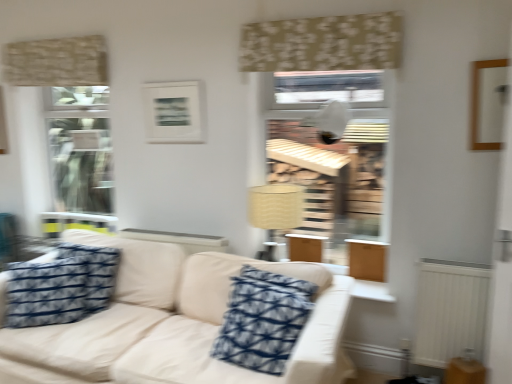
Where is `beige floral fabric at upper center, which is the 2th curtain in left-to-right order`? This screenshot has width=512, height=384. beige floral fabric at upper center, which is the 2th curtain in left-to-right order is located at coordinates (322, 43).

Where is `beige fabric lampshade at center`? beige fabric lampshade at center is located at coordinates (275, 211).

Describe the element at coordinates (61, 286) in the screenshot. This screenshot has width=512, height=384. I see `blue printed fabric pillow at left, acting as the second pillow starting from the right` at that location.

What is the approximate width of blue printed fabric pillow at left, which is counted as the 1th pillow, starting from the left?

11.72 inches.

What is the approximate width of beige textured curtain at upper left, positioned as the 2th curtain in front-to-back order?

beige textured curtain at upper left, positioned as the 2th curtain in front-to-back order, is 4.72 inches in width.

Describe the element at coordinates (488, 103) in the screenshot. I see `wooden picture frame at upper right, which is counted as the second picture frame, starting from the back` at that location.

Locate an element on the screen. This screenshot has width=512, height=384. beige floral fabric at upper center, which appears as the 1th curtain when viewed from the front is located at coordinates (322, 43).

Do you think blue printed fabric pillow at center, placed as the 1th pillow when sorted from right to left, is within wooden picture frame at upper right, placed as the first picture frame when sorted from front to back, or outside of it?

blue printed fabric pillow at center, placed as the 1th pillow when sorted from right to left, lies outside wooden picture frame at upper right, placed as the first picture frame when sorted from front to back.

Considering the relative sizes of blue printed fabric pillow at center, placed as the 1th pillow when sorted from right to left, and wooden picture frame at upper right, which is counted as the second picture frame, starting from the back, in the image provided, is blue printed fabric pillow at center, placed as the 1th pillow when sorted from right to left, taller than wooden picture frame at upper right, which is counted as the second picture frame, starting from the back,?

Correct, blue printed fabric pillow at center, placed as the 1th pillow when sorted from right to left, is much taller as wooden picture frame at upper right, which is counted as the second picture frame, starting from the back.

From a real-world perspective, between blue printed fabric pillow at center, placed as the 1th pillow when sorted from right to left, and wooden picture frame at upper right, placed as the first picture frame when sorted from front to back, who is vertically lower?

blue printed fabric pillow at center, placed as the 1th pillow when sorted from right to left.

Is point (257, 289) positioned before point (497, 117)?

Yes, point (257, 289) is closer to viewer.

At what (x,y) coordinates should I click in order to perform the action: click on table on the left of wooden picture frame at upper right, the first picture frame when ordered from right to left. Please return your answer as a coordinate pair (x, y). The height and width of the screenshot is (384, 512). Looking at the image, I should click on (464, 371).

In the scene shown: Measure the distance between wooden table at lower right and wooden picture frame at upper right, the first picture frame when ordered from right to left.

They are 4.16 feet apart.

From the image's perspective, which one is positioned lower, wooden table at lower right or wooden picture frame at upper right, positioned as the second picture frame in left-to-right order?

From the image's view, wooden table at lower right is below.

What's the angular difference between wooden table at lower right and wooden picture frame at upper right, positioned as the second picture frame in left-to-right order,'s facing directions?

The facing directions of wooden table at lower right and wooden picture frame at upper right, positioned as the second picture frame in left-to-right order, are 52.9 degrees apart.

Where is `the 2nd curtain to the left when counting from the white textured radiator at lower right`? the 2nd curtain to the left when counting from the white textured radiator at lower right is located at coordinates (56, 62).

Is beige textured curtain at upper left, acting as the first curtain starting from the left, looking in the opposite direction of white textured radiator at lower right?

No, beige textured curtain at upper left, acting as the first curtain starting from the left, is not facing away from white textured radiator at lower right.

Would you say beige textured curtain at upper left, arranged as the second curtain when viewed from the right, is to the left or to the right of white textured radiator at lower right in the picture?

beige textured curtain at upper left, arranged as the second curtain when viewed from the right, is to the left of white textured radiator at lower right.

Looking at this image, would you consider beige textured curtain at upper left, positioned as the 2th curtain in front-to-back order, to be distant from white textured radiator at lower right?

That's right, there is a large distance between beige textured curtain at upper left, positioned as the 2th curtain in front-to-back order, and white textured radiator at lower right.

Considering the positions of objects wooden picture frame at upper right, placed as the first picture frame when sorted from front to back, and blue printed fabric pillow at left, which is counted as the 1th pillow, starting from the left, in the image provided, who is behind, wooden picture frame at upper right, placed as the first picture frame when sorted from front to back, or blue printed fabric pillow at left, which is counted as the 1th pillow, starting from the left,?

blue printed fabric pillow at left, which is counted as the 1th pillow, starting from the left, is further from the camera.

From a real-world perspective, is wooden picture frame at upper right, the first picture frame when ordered from right to left, positioned above or below blue printed fabric pillow at left, acting as the second pillow starting from the right?

From a real-world perspective, wooden picture frame at upper right, the first picture frame when ordered from right to left, is physically above blue printed fabric pillow at left, acting as the second pillow starting from the right.

How different are the orientations of wooden picture frame at upper right, placed as the first picture frame when sorted from front to back, and blue printed fabric pillow at left, which is counted as the 1th pillow, starting from the left, in degrees?

Answer: The facing directions of wooden picture frame at upper right, placed as the first picture frame when sorted from front to back, and blue printed fabric pillow at left, which is counted as the 1th pillow, starting from the left, are 29.8 degrees apart.

Is wooden picture frame at upper right, the first picture frame when ordered from right to left, facing away from blue printed fabric pillow at left, which is counted as the 1th pillow, starting from the left?

That's not correct — wooden picture frame at upper right, the first picture frame when ordered from right to left, is not looking away from blue printed fabric pillow at left, which is counted as the 1th pillow, starting from the left.

Considering the sizes of objects blue printed fabric pillow at left, acting as the second pillow starting from the right, and wooden picture frame at upper right, which is counted as the second picture frame, starting from the back, in the image provided, who is wider, blue printed fabric pillow at left, acting as the second pillow starting from the right, or wooden picture frame at upper right, which is counted as the second picture frame, starting from the back,?

With larger width is blue printed fabric pillow at left, acting as the second pillow starting from the right.

From the picture: From a real-world perspective, which object rests below the other?

blue printed fabric pillow at left, which is counted as the 1th pillow, starting from the left.

Is blue printed fabric pillow at left, which is counted as the 1th pillow, starting from the left, positioned with its back to wooden picture frame at upper right, placed as the first picture frame when sorted from front to back?

No, blue printed fabric pillow at left, which is counted as the 1th pillow, starting from the left, is not facing away from wooden picture frame at upper right, placed as the first picture frame when sorted from front to back.

Can you confirm if wooden picture frame at upper right, positioned as the second picture frame in left-to-right order, is shorter than beige textured curtain at upper left, acting as the first curtain starting from the back?

In fact, wooden picture frame at upper right, positioned as the second picture frame in left-to-right order, may be taller than beige textured curtain at upper left, acting as the first curtain starting from the back.

Which of these two, wooden picture frame at upper right, positioned as the second picture frame in left-to-right order, or beige textured curtain at upper left, positioned as the 2th curtain in front-to-back order, is smaller?

Smaller between the two is wooden picture frame at upper right, positioned as the second picture frame in left-to-right order.

The image size is (512, 384). Identify the location of the 2nd picture frame below the beige textured curtain at upper left, positioned as the 2th curtain in front-to-back order (from the image's perspective). (488, 103).

Can you tell me how much white matte picture frame at upper center, positioned as the second picture frame in front-to-back order, and wooden picture frame at upper right, which is counted as the second picture frame, starting from the back, differ in facing direction?

0.00986 degrees.

Is white matte picture frame at upper center, positioned as the 1th picture frame in left-to-right order, in front of or behind wooden picture frame at upper right, placed as the first picture frame when sorted from front to back, in the image?

white matte picture frame at upper center, positioned as the 1th picture frame in left-to-right order, is positioned farther from the viewer than wooden picture frame at upper right, placed as the first picture frame when sorted from front to back.

Considering the relative positions of white matte picture frame at upper center, which ranks as the first picture frame in back-to-front order, and wooden picture frame at upper right, the first picture frame when ordered from right to left, in the image provided, is white matte picture frame at upper center, which ranks as the first picture frame in back-to-front order, to the left of wooden picture frame at upper right, the first picture frame when ordered from right to left, from the viewer's perspective?

Correct, you'll find white matte picture frame at upper center, which ranks as the first picture frame in back-to-front order, to the left of wooden picture frame at upper right, the first picture frame when ordered from right to left.

Is white matte picture frame at upper center, positioned as the second picture frame in front-to-back order, thinner than wooden picture frame at upper right, which is counted as the second picture frame, starting from the back?

Correct, the width of white matte picture frame at upper center, positioned as the second picture frame in front-to-back order, is less than that of wooden picture frame at upper right, which is counted as the second picture frame, starting from the back.

From a real-world perspective, starting from the wooden picture frame at upper right, which is counted as the second picture frame, starting from the back, which pillow is the 1st one below it? Please provide its 2D coordinates.

[(263, 320)]

The height and width of the screenshot is (384, 512). Identify the location of table that appears on the left of wooden picture frame at upper right, the first picture frame when ordered from right to left. (464, 371).

Consider the image. Looking at the image, which one is located further to beige fabric couch at center, blue printed fabric pillow at center, placed as the 1th pillow when sorted from right to left, or beige textured curtain at upper left, acting as the first curtain starting from the back?

beige textured curtain at upper left, acting as the first curtain starting from the back.

From the image, which object appears to be farther from white matte picture frame at upper center, positioned as the 1th picture frame in left-to-right order, beige floral fabric at upper center, which is the 2th curtain in left-to-right order, or blue printed fabric pillow at left, acting as the second pillow starting from the right?

blue printed fabric pillow at left, acting as the second pillow starting from the right, is positioned further to the anchor white matte picture frame at upper center, positioned as the 1th picture frame in left-to-right order.

From the image, which object appears to be farther from wooden picture frame at upper right, which is counted as the second picture frame, starting from the back, beige floral fabric at upper center, which is the 2th curtain in back-to-front order, or blue printed fabric pillow at center, placed as the 1th pillow when sorted from right to left?

The object further to wooden picture frame at upper right, which is counted as the second picture frame, starting from the back, is blue printed fabric pillow at center, placed as the 1th pillow when sorted from right to left.

Looking at this image, based on their spatial positions, is beige textured curtain at upper left, positioned as the 2th curtain in front-to-back order, or blue printed fabric pillow at left, which is counted as the 1th pillow, starting from the left, closer to wooden table at lower right?

blue printed fabric pillow at left, which is counted as the 1th pillow, starting from the left, is positioned closer to the anchor wooden table at lower right.

Based on their spatial positions, is blue printed fabric pillow at center, placed as the 1th pillow when sorted from right to left, or wooden table at lower right further from beige floral fabric at upper center, which appears as the 1th curtain when viewed from the front?

The object further to beige floral fabric at upper center, which appears as the 1th curtain when viewed from the front, is wooden table at lower right.

When comparing their distances from white textured radiator at lower right, does white matte picture frame at upper center, which is the 2th picture frame from right to left, or beige fabric couch at center seem closer?

beige fabric couch at center is positioned closer to the anchor white textured radiator at lower right.

Which object lies further to the anchor point blue printed fabric pillow at left, acting as the second pillow starting from the right, beige fabric couch at center or blue printed fabric pillow at center, placed as the 1th pillow when sorted from right to left?

blue printed fabric pillow at center, placed as the 1th pillow when sorted from right to left, lies further to blue printed fabric pillow at left, acting as the second pillow starting from the right, than the other object.

Estimate the real-world distances between objects in this image. Which object is further from blue printed fabric pillow at left, which is counted as the 1th pillow, starting from the left, beige textured curtain at upper left, positioned as the 2th curtain in front-to-back order, or white textured radiator at lower right?

white textured radiator at lower right is further to blue printed fabric pillow at left, which is counted as the 1th pillow, starting from the left.

Image resolution: width=512 pixels, height=384 pixels. Find the location of `radiator between beige floral fabric at upper center, which appears as the 1th curtain when viewed from the front, and wooden table at lower right, in the vertical direction`. radiator between beige floral fabric at upper center, which appears as the 1th curtain when viewed from the front, and wooden table at lower right, in the vertical direction is located at coordinates (450, 310).

The height and width of the screenshot is (384, 512). In order to click on lamp between wooden picture frame at upper right, the first picture frame when ordered from right to left, and white textured radiator at lower right, in the vertical direction in this screenshot , I will do `click(275, 211)`.

What are the coordinates of `studio couch located between blue printed fabric pillow at left, which is counted as the 1th pillow, starting from the left, and blue printed fabric pillow at center, which appears as the second pillow when viewed from the left, in the left-right direction` in the screenshot? It's located at (174, 324).

Identify the location of studio couch between beige floral fabric at upper center, which is the 2th curtain in back-to-front order, and white textured radiator at lower right, in the vertical direction. (174, 324).